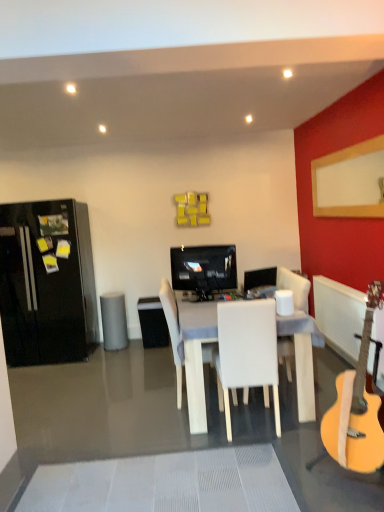
Where is `unoccupied region to the right of white matte chair at center, which ranks as the first chair in front-to-back order`? unoccupied region to the right of white matte chair at center, which ranks as the first chair in front-to-back order is located at coordinates click(297, 419).